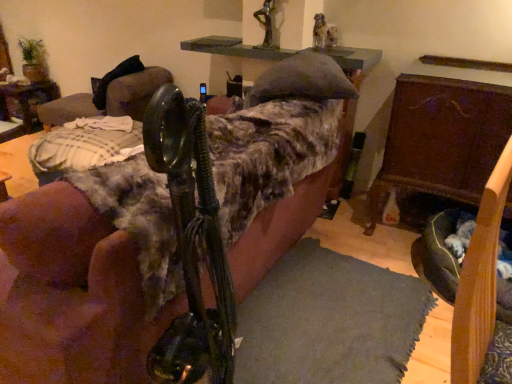
Question: Is metallic statue at upper center wider than wooden chest at right, placed as the first furniture when sorted from right to left?

Choices:
 (A) no
 (B) yes

Answer: (A)

Question: Is metallic statue at upper center outside of wooden chest at right, placed as the first furniture when sorted from right to left?

Choices:
 (A) yes
 (B) no

Answer: (A)

Question: Is metallic statue at upper center looking in the opposite direction of wooden chest at right, which is the second furniture in left-to-right order?

Choices:
 (A) yes
 (B) no

Answer: (B)

Question: Does metallic statue at upper center contain wooden chest at right, which is the second furniture in left-to-right order?

Choices:
 (A) yes
 (B) no

Answer: (B)

Question: Does metallic statue at upper center appear on the right side of wooden chest at right, which is the second furniture in left-to-right order?

Choices:
 (A) yes
 (B) no

Answer: (B)

Question: Considering the relative positions of dark gray fabric dog bed at lower right and velvet couch at center, placed as the second furniture when sorted from right to left, in the image provided, is dark gray fabric dog bed at lower right to the left or to the right of velvet couch at center, placed as the second furniture when sorted from right to left,?

Choices:
 (A) left
 (B) right

Answer: (B)

Question: From a real-world perspective, relative to velvet couch at center, placed as the second furniture when sorted from right to left, is dark gray fabric dog bed at lower right vertically above or below?

Choices:
 (A) above
 (B) below

Answer: (B)

Question: Choose the correct answer: Is dark gray fabric dog bed at lower right inside velvet couch at center, placed as the second furniture when sorted from right to left, or outside it?

Choices:
 (A) outside
 (B) inside

Answer: (A)

Question: Is dark gray fabric dog bed at lower right wider or thinner than velvet couch at center, the first furniture viewed from the left?

Choices:
 (A) wide
 (B) thin

Answer: (B)

Question: Is velvet couch at center, placed as the second furniture when sorted from right to left, in front of or behind wooden table at left in the image?

Choices:
 (A) front
 (B) behind

Answer: (A)

Question: Is velvet couch at center, placed as the second furniture when sorted from right to left, taller or shorter than wooden table at left?

Choices:
 (A) short
 (B) tall

Answer: (B)

Question: From a real-world perspective, is velvet couch at center, the first furniture viewed from the left, above or below wooden table at left?

Choices:
 (A) above
 (B) below

Answer: (A)

Question: Is point (74, 175) positioned closer to the camera than point (28, 115)?

Choices:
 (A) farther
 (B) closer

Answer: (B)

Question: Considering the relative positions of wooden chest at right, which is the second furniture in left-to-right order, and dark gray fabric dog bed at lower right in the image provided, is wooden chest at right, which is the second furniture in left-to-right order, to the left or to the right of dark gray fabric dog bed at lower right?

Choices:
 (A) right
 (B) left

Answer: (A)

Question: Do you think wooden chest at right, placed as the first furniture when sorted from right to left, is within dark gray fabric dog bed at lower right, or outside of it?

Choices:
 (A) outside
 (B) inside

Answer: (A)